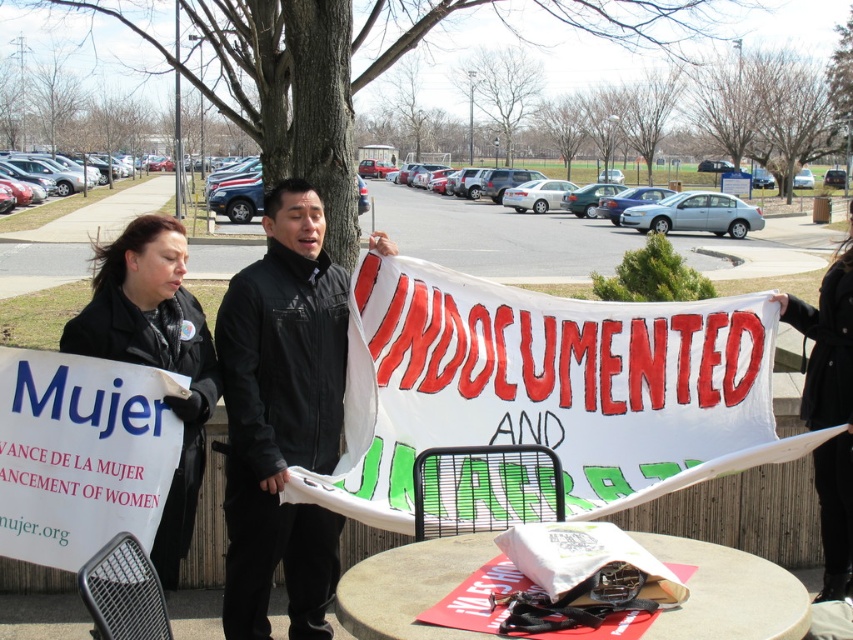
Where is `black leather jacket at lower left`? Image resolution: width=853 pixels, height=640 pixels. black leather jacket at lower left is located at coordinates pos(155,355).

The width and height of the screenshot is (853, 640). Find the location of `black leather jacket at lower left`. black leather jacket at lower left is located at coordinates (155, 355).

Does black matte jacket at center come behind black fabric sign at right?

That is False.

Is black matte jacket at center smaller than black fabric sign at right?

No, black matte jacket at center is not smaller than black fabric sign at right.

Find the location of `black matte jacket at center`. black matte jacket at center is located at coordinates (282, 417).

Locate an element on the screen. The width and height of the screenshot is (853, 640). black matte jacket at center is located at coordinates (282, 417).

Who is positioned more to the right, black matte jacket at center or black leather jacket at lower left?

Positioned to the right is black matte jacket at center.

In the scene shown: Does black matte jacket at center lie in front of black leather jacket at lower left?

No, it is not.

Image resolution: width=853 pixels, height=640 pixels. I want to click on black matte jacket at center, so click(x=282, y=417).